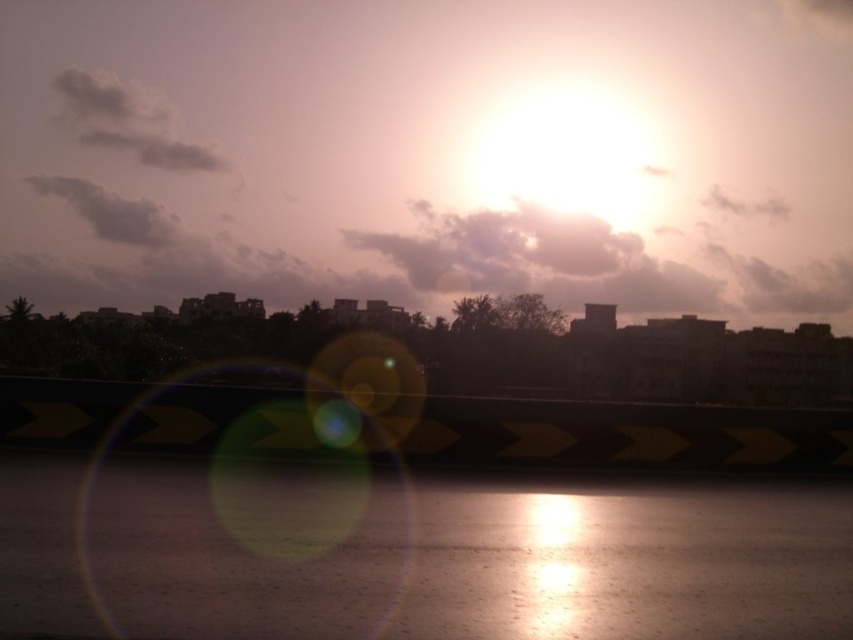
Can you confirm if yellow-black striped barrier at bottom is taller than gray fluffy cloud at upper left?

No, yellow-black striped barrier at bottom is not taller than gray fluffy cloud at upper left.

Is the position of yellow-black striped barrier at bottom less distant than that of gray fluffy cloud at upper left?

Yes, yellow-black striped barrier at bottom is in front of gray fluffy cloud at upper left.

You are a GUI agent. You are given a task and a screenshot of the screen. Output one action in this format:
    pyautogui.click(x=<x>, y=<y>)
    Task: Click on the yellow-black striped barrier at bottom
    This screenshot has height=640, width=853.
    Given the screenshot: What is the action you would take?
    pyautogui.click(x=630, y=435)

This screenshot has width=853, height=640. What are the coordinates of `yellow-black striped barrier at bottom` in the screenshot? It's located at (630, 435).

Which is more to the right, yellow-black striped barrier at bottom or white fluffy cloud at upper left?

From the viewer's perspective, yellow-black striped barrier at bottom appears more on the right side.

Describe the element at coordinates (630, 435) in the screenshot. I see `yellow-black striped barrier at bottom` at that location.

Where is `yellow-black striped barrier at bottom`? yellow-black striped barrier at bottom is located at coordinates (630, 435).

Who is taller, white fluffy cloud at upper left or gray fluffy cloud at upper left?

With more height is white fluffy cloud at upper left.

Does white fluffy cloud at upper left have a larger size compared to gray fluffy cloud at upper left?

Indeed, white fluffy cloud at upper left has a larger size compared to gray fluffy cloud at upper left.

What do you see at coordinates (126, 120) in the screenshot? This screenshot has height=640, width=853. I see `white fluffy cloud at upper left` at bounding box center [126, 120].

At what (x,y) coordinates should I click in order to perform the action: click on white fluffy cloud at upper left. Please return your answer as a coordinate pair (x, y). Looking at the image, I should click on (126, 120).